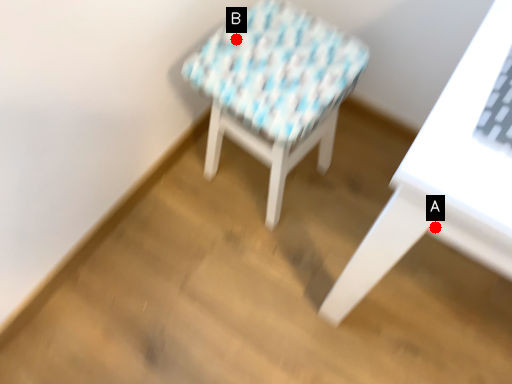
Question: Two points are circled on the image, labeled by A and B beside each circle. Which point is closer to the camera?

Choices:
 (A) A is closer
 (B) B is closer

Answer: (A)